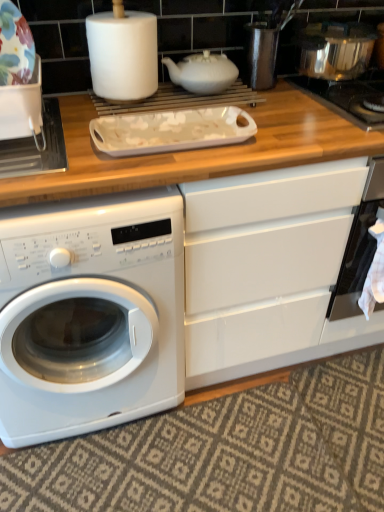
What do you see at coordinates (335, 50) in the screenshot? This screenshot has width=384, height=512. I see `shiny metallic pot at upper right, which appears as the second appliance when ordered from the bottom` at bounding box center [335, 50].

The height and width of the screenshot is (512, 384). What do you see at coordinates (90, 314) in the screenshot?
I see `white glossy washing machine at lower left` at bounding box center [90, 314].

Based on the photo, in order to face stainless steel gas stove at upper right, should I rotate leftwards or rightwards?

A 23.473 degree turn to the right will do.

At what (x,y) coordinates should I click in order to perform the action: click on porcelain floral plate at upper left, the second appliance in the right-to-left sequence. Please return your answer as a coordinate pair (x, y). The height and width of the screenshot is (512, 384). Looking at the image, I should click on (22, 106).

Does black glass oven at right have a lesser height compared to porcelain floral plate at upper left, which is the 1th appliance in front-to-back order?

No, black glass oven at right is not shorter than porcelain floral plate at upper left, which is the 1th appliance in front-to-back order.

How distant is black glass oven at right from porcelain floral plate at upper left, arranged as the 2th appliance when viewed from the top?

black glass oven at right is 99.57 centimeters away from porcelain floral plate at upper left, arranged as the 2th appliance when viewed from the top.

Identify the location of the 2nd appliance to the left when counting from the black glass oven at right. (22, 106).

Can you confirm if black glass oven at right is smaller than porcelain floral plate at upper left, which is counted as the 1th appliance, starting from the left?

No.

Based on the photo, who is more distant, porcelain floral plate at upper left, the second appliance positioned from the back, or white glossy washing machine at lower left?

porcelain floral plate at upper left, the second appliance positioned from the back, is further from the camera.

Choose the correct answer: Is porcelain floral plate at upper left, the second appliance positioned from the back, inside white glossy washing machine at lower left or outside it?

porcelain floral plate at upper left, the second appliance positioned from the back, is not inside white glossy washing machine at lower left, it's outside.

Is porcelain floral plate at upper left, the second appliance in the right-to-left sequence, turned away from white glossy washing machine at lower left?

No.

Is porcelain floral plate at upper left, the second appliance in the right-to-left sequence, taller or shorter than white glossy washing machine at lower left?

porcelain floral plate at upper left, the second appliance in the right-to-left sequence, is shorter than white glossy washing machine at lower left.

How far apart are black glass oven at right and stainless steel gas stove at upper right?

black glass oven at right is 15.10 inches from stainless steel gas stove at upper right.

Between point (358, 216) and point (347, 118), which one is positioned in front?

The point (347, 118) is in front.

Is black glass oven at right to the left of stainless steel gas stove at upper right from the viewer's perspective?

No.

Can you confirm if black glass oven at right is wider than stainless steel gas stove at upper right?

Incorrect, the width of black glass oven at right does not surpass that of stainless steel gas stove at upper right.

At what (x,y) coordinates should I click in order to perform the action: click on gas stove that is behind the porcelain floral plate at upper left, the second appliance positioned from the back. Please return your answer as a coordinate pair (x, y). Looking at the image, I should click on (345, 98).

Who is smaller, stainless steel gas stove at upper right or porcelain floral plate at upper left, which is counted as the 1th appliance, starting from the left?

porcelain floral plate at upper left, which is counted as the 1th appliance, starting from the left.

Could you tell me if stainless steel gas stove at upper right is facing porcelain floral plate at upper left, which is the 1th appliance in front-to-back order?

No, stainless steel gas stove at upper right is not oriented towards porcelain floral plate at upper left, which is the 1th appliance in front-to-back order.

Is stainless steel gas stove at upper right to the left of porcelain floral plate at upper left, which is counted as the 1th appliance, starting from the left, from the viewer's perspective?

Incorrect, stainless steel gas stove at upper right is not on the left side of porcelain floral plate at upper left, which is counted as the 1th appliance, starting from the left.

Is point (42, 378) in front of point (372, 82)?

That is True.

The height and width of the screenshot is (512, 384). What are the coordinates of `washing machine located in front of the stainless steel gas stove at upper right` in the screenshot? It's located at (90, 314).

Considering the relative sizes of white glossy washing machine at lower left and stainless steel gas stove at upper right in the image provided, is white glossy washing machine at lower left wider than stainless steel gas stove at upper right?

Yes.

Is white glossy washing machine at lower left located outside stainless steel gas stove at upper right?

Yes, white glossy washing machine at lower left is located beyond the bounds of stainless steel gas stove at upper right.

From the image's perspective, between white matte paper towel at upper center and black glass oven at right, who is located below?

black glass oven at right is shown below in the image.

Is white matte paper towel at upper center far away from black glass oven at right?

No, white matte paper towel at upper center is not far away from black glass oven at right.

In the scene shown: Is white matte paper towel at upper center taller or shorter than black glass oven at right?

white matte paper towel at upper center is shorter than black glass oven at right.

Is white matte paper towel at upper center surrounding porcelain floral plate at upper left, the second appliance positioned from the back?

No, porcelain floral plate at upper left, the second appliance positioned from the back, is not a part of white matte paper towel at upper center.

How many degrees apart are the facing directions of white matte paper towel at upper center and porcelain floral plate at upper left, which is the 1th appliance in front-to-back order?

They differ by 2.43 degrees in their facing directions.

From the picture: Is white matte paper towel at upper center taller or shorter than porcelain floral plate at upper left, which is the 1th appliance in front-to-back order?

white matte paper towel at upper center is taller than porcelain floral plate at upper left, which is the 1th appliance in front-to-back order.

Is porcelain floral plate at upper left, arranged as the first appliance when ordered from the bottom, at the back of white matte paper towel at upper center?

white matte paper towel at upper center is not turned away from porcelain floral plate at upper left, arranged as the first appliance when ordered from the bottom.

The height and width of the screenshot is (512, 384). I want to click on appliance in front of the black glass oven at right, so click(22, 106).

In order to click on washing machine that is on the right side of porcelain floral plate at upper left, the second appliance in the right-to-left sequence in this screenshot , I will do `click(90, 314)`.

Looking at this image, considering their positions, is white matte teapot at upper center positioned further to shiny metallic pot at upper right, the first appliance viewed from the top, than white matte paper towel at upper center?

Among the two, white matte paper towel at upper center is located further to shiny metallic pot at upper right, the first appliance viewed from the top.

Considering their positions, is porcelain floral plate at upper left, the second appliance positioned from the back, positioned further to white matte paper towel at upper center than shiny metallic pot at upper right, arranged as the second appliance when viewed from the front?

shiny metallic pot at upper right, arranged as the second appliance when viewed from the front.

Based on the photo, which object lies further to the anchor point white matte teapot at upper center, shiny metallic pot at upper right, which ranks as the first appliance in right-to-left order, or white matte paper towel at upper center?

Based on the image, shiny metallic pot at upper right, which ranks as the first appliance in right-to-left order, appears to be further to white matte teapot at upper center.

Looking at the image, which one is located closer to porcelain floral plate at upper left, the second appliance positioned from the back, white matte teapot at upper center or white glossy washing machine at lower left?

Based on the image, white matte teapot at upper center appears to be nearer to porcelain floral plate at upper left, the second appliance positioned from the back.

Based on their spatial positions, is white matte paper towel at upper center or white matte teapot at upper center closer to porcelain floral plate at upper left, arranged as the 2th appliance when viewed from the top?

Among the two, white matte paper towel at upper center is located nearer to porcelain floral plate at upper left, arranged as the 2th appliance when viewed from the top.

Considering their positions, is stainless steel gas stove at upper right positioned further to shiny metallic pot at upper right, the first appliance viewed from the top, than porcelain floral plate at upper left, the second appliance positioned from the back?

Among the two, porcelain floral plate at upper left, the second appliance positioned from the back, is located further to shiny metallic pot at upper right, the first appliance viewed from the top.

When comparing their distances from white glossy washing machine at lower left, does porcelain floral plate at upper left, arranged as the 2th appliance when viewed from the top, or white matte paper towel at upper center seem further?

Among the two, white matte paper towel at upper center is located further to white glossy washing machine at lower left.

Based on the photo, when comparing their distances from shiny metallic pot at upper right, the second appliance in the left-to-right sequence, does white glossy washing machine at lower left or black glass oven at right seem closer?

Based on the image, black glass oven at right appears to be nearer to shiny metallic pot at upper right, the second appliance in the left-to-right sequence.

This screenshot has width=384, height=512. In order to click on paper towel between white glossy washing machine at lower left and black glass oven at right in the horizontal direction in this screenshot , I will do `click(123, 53)`.

Where is `tea pot that lies between shiny metallic pot at upper right, the first appliance viewed from the top, and black glass oven at right from top to bottom`? The image size is (384, 512). tea pot that lies between shiny metallic pot at upper right, the first appliance viewed from the top, and black glass oven at right from top to bottom is located at coordinates 202,72.

At what (x,y) coordinates should I click in order to perform the action: click on tea pot between porcelain floral plate at upper left, the second appliance in the right-to-left sequence, and shiny metallic pot at upper right, which ranks as the first appliance in right-to-left order, in the horizontal direction. Please return your answer as a coordinate pair (x, y). Looking at the image, I should click on (202, 72).

Locate an element on the screen. The height and width of the screenshot is (512, 384). gas stove between shiny metallic pot at upper right, arranged as the second appliance when viewed from the front, and black glass oven at right in the up-down direction is located at coordinates (345, 98).